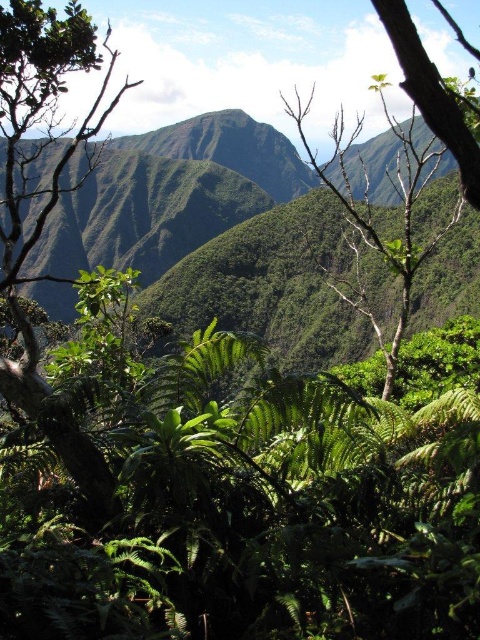
Question: Which point is farther from the camera taking this photo?

Choices:
 (A) (295, 93)
 (B) (404, 84)

Answer: (A)

Question: Can you confirm if green leafy tree at center is bigger than smooth bark tree at upper right?

Choices:
 (A) no
 (B) yes

Answer: (B)

Question: Is the position of green leafy tree at center less distant than that of smooth bark tree at upper right?

Choices:
 (A) no
 (B) yes

Answer: (A)

Question: Which object is farther from the camera taking this photo?

Choices:
 (A) smooth bark tree at upper right
 (B) green leafy tree at center

Answer: (B)

Question: Is green leafy tree at center above smooth bark tree at upper right?

Choices:
 (A) no
 (B) yes

Answer: (B)